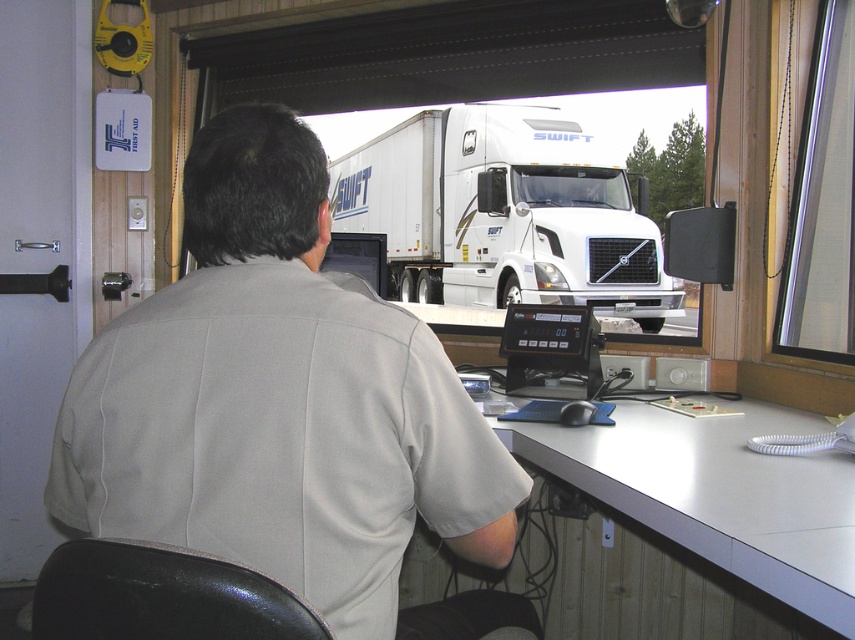
Question: Which object is the farthest from the gray fabric shirt at center?

Choices:
 (A) white glossy truck at center
 (B) white glossy truck driver at center

Answer: (B)

Question: Does white glossy truck at center have a greater width compared to white glossy truck driver at center?

Choices:
 (A) yes
 (B) no

Answer: (A)

Question: Observing the image, what is the correct spatial positioning of gray fabric shirt at center in reference to white glossy truck at center?

Choices:
 (A) right
 (B) left

Answer: (B)

Question: Is white glossy truck at center to the left of white glossy truck driver at center from the viewer's perspective?

Choices:
 (A) no
 (B) yes

Answer: (B)

Question: Which point appears farthest from the camera in this image?

Choices:
 (A) (576, 445)
 (B) (186, 342)

Answer: (A)

Question: Among these objects, which one is nearest to the camera?

Choices:
 (A) gray fabric shirt at center
 (B) white glossy truck at center
 (C) white glossy truck driver at center
 (D) white glossy computer desk at lower right

Answer: (A)